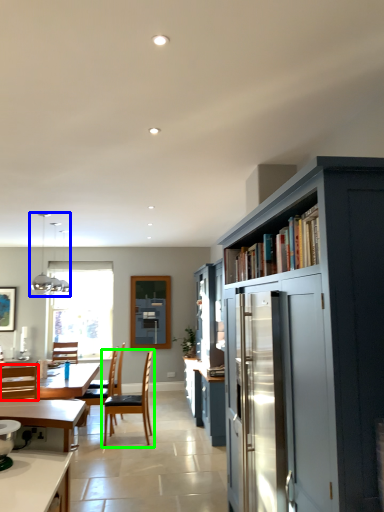
Question: Which object is positioned closest to chair (highlighted by a red box)? Select from light fixture (highlighted by a blue box) and chair (highlighted by a green box).

Choices:
 (A) light fixture
 (B) chair

Answer: (B)